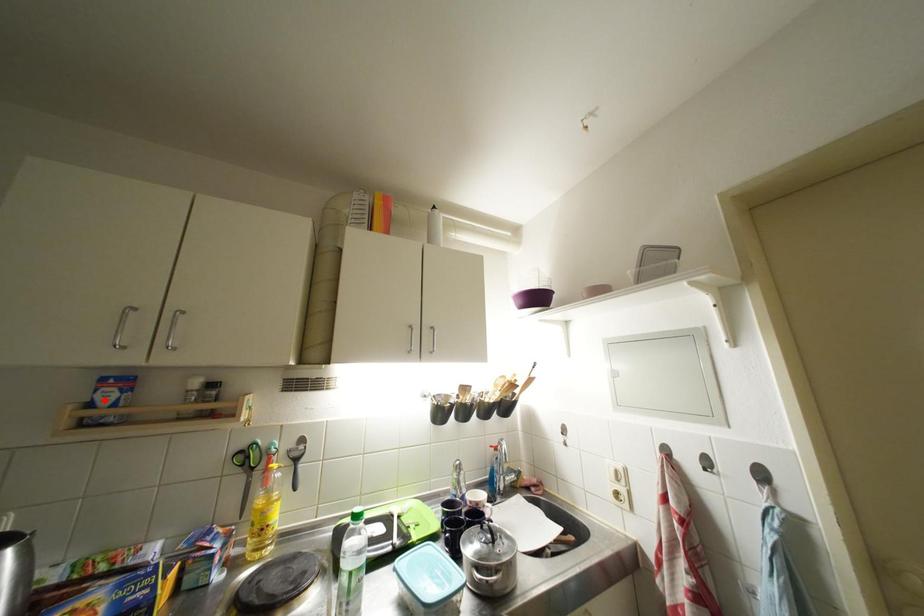
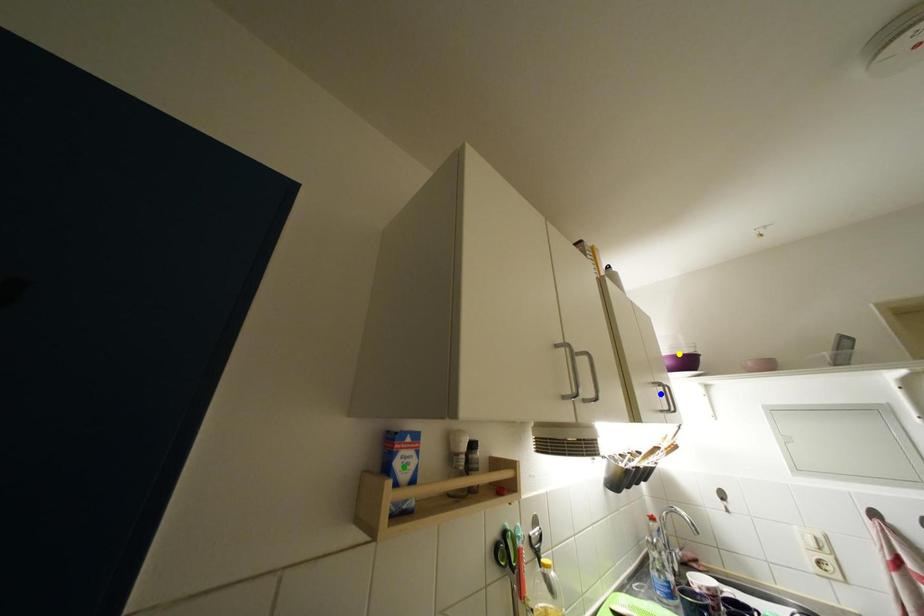
Question: I am providing you with two images of the same scene from different viewpoints. A red point is marked on the first image. You are given multiple points on the second image. Which spot in image 2 lines up with the point in image 1?

Choices:
 (A) green point
 (B) yellow point
 (C) blue point

Answer: (A)